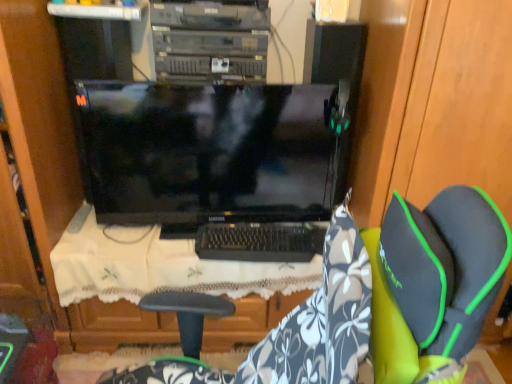
What are the coordinates of `wooden dresser at left` in the screenshot? It's located at (41, 133).

This screenshot has width=512, height=384. Describe the element at coordinates (210, 153) in the screenshot. I see `black glossy monitor at center` at that location.

Find the location of a particular element. black plastic keyboard at center is located at coordinates (258, 242).

This screenshot has height=384, width=512. Identify the location of wooden dresser at left. tap(41, 133).

There is a black plastic keyboard at center. At what (x,y) coordinates should I click in order to perform the action: click on chair above it (from a real-world perspective). Please return your answer as a coordinate pair (x, y). Looking at the image, I should click on (378, 302).

From the image's perspective, is floral fabric chair at center located beneath black plastic keyboard at center?

Yes, from the image's perspective, floral fabric chair at center is beneath black plastic keyboard at center.

Can you confirm if floral fabric chair at center is taller than black plastic keyboard at center?

Indeed, floral fabric chair at center has a greater height compared to black plastic keyboard at center.

Is floral fabric chair at center spatially inside black plastic keyboard at center, or outside of it?

floral fabric chair at center cannot be found inside black plastic keyboard at center.

Is wooden dresser at left smaller than black glossy monitor at center?

Incorrect, wooden dresser at left is not smaller in size than black glossy monitor at center.

Is wooden dresser at left to the left or to the right of black glossy monitor at center in the image?

wooden dresser at left is to the left of black glossy monitor at center.

From the picture: From a real-world perspective, is wooden dresser at left physically below black glossy monitor at center?

Yes.

Looking at this image, how different are the orientations of wooden dresser at left and black glossy monitor at center in degrees?

1.23 degrees separate the facing orientations of wooden dresser at left and black glossy monitor at center.

Relative to wooden dresser at left, is white lace cloth at center in front or behind?

white lace cloth at center is positioned farther from the viewer than wooden dresser at left.

Is white lace cloth at center far from wooden dresser at left?

No.

Could you tell me if white lace cloth at center is facing wooden dresser at left?

No.

Based on their sizes in the image, would you say white lace cloth at center is bigger or smaller than wooden dresser at left?

Considering their sizes, white lace cloth at center takes up less space than wooden dresser at left.

Find the location of a particular element. The width and height of the screenshot is (512, 384). chair that is below the white lace cloth at center (from the image's perspective) is located at coordinates (378, 302).

Considering the positions of point (60, 261) and point (385, 225), is point (60, 261) closer or farther from the camera than point (385, 225)?

Point (60, 261) is farther from the camera than point (385, 225).

From a real-world perspective, is white lace cloth at center below floral fabric chair at center?

Yes.

Is white lace cloth at center in front of or behind floral fabric chair at center in the image?

white lace cloth at center is positioned farther from the viewer than floral fabric chair at center.

Does wooden dresser at left have a lesser width compared to floral fabric chair at center?

Incorrect, the width of wooden dresser at left is not less than that of floral fabric chair at center.

Locate an element on the screen. The height and width of the screenshot is (384, 512). chair located in front of the wooden dresser at left is located at coordinates (378, 302).

Considering the sizes of objects wooden dresser at left and floral fabric chair at center in the image provided, who is shorter, wooden dresser at left or floral fabric chair at center?

floral fabric chair at center.

Between wooden dresser at left and floral fabric chair at center, which one appears on the right side from the viewer's perspective?

floral fabric chair at center.

From a real-world perspective, which is physically above, black plastic keyboard at center or wooden dresser at left?

From a 3D spatial view, wooden dresser at left is above.

Between black plastic keyboard at center and wooden dresser at left, which one has less height?

With less height is black plastic keyboard at center.

Can you confirm if black plastic keyboard at center is wider than wooden dresser at left?

No.

How many degrees apart are the facing directions of black glossy monitor at center and black plastic keyboard at center?

1.23 degrees.

Is black glossy monitor at center looking in the opposite direction of black plastic keyboard at center?

No.

From a real-world perspective, between black glossy monitor at center and black plastic keyboard at center, who is vertically lower?

From a 3D spatial view, black plastic keyboard at center is below.

The image size is (512, 384). I want to click on chair located in front of the black plastic keyboard at center, so click(x=378, y=302).

Find the location of `dresser located underneath the black glossy monitor at center (from a real-world perspective)`. dresser located underneath the black glossy monitor at center (from a real-world perspective) is located at coordinates (41, 133).

When comparing their distances from black glossy monitor at center, does black plastic keyboard at center or wooden dresser at left seem further?

Based on the image, wooden dresser at left appears to be further to black glossy monitor at center.

Considering their positions, is white lace cloth at center positioned closer to wooden dresser at left than black glossy monitor at center?

white lace cloth at center is closer to wooden dresser at left.

Based on their spatial positions, is wooden dresser at left or black plastic keyboard at center closer to floral fabric chair at center?

black plastic keyboard at center.

Considering their positions, is wooden dresser at left positioned closer to white lace cloth at center than black plastic keyboard at center?

black plastic keyboard at center.

Estimate the real-world distances between objects in this image. Which object is further from black glossy monitor at center, wooden dresser at left or floral fabric chair at center?

floral fabric chair at center lies further to black glossy monitor at center than the other object.

Which object lies further to the anchor point black glossy monitor at center, white lace cloth at center or wooden dresser at left?

The object further to black glossy monitor at center is wooden dresser at left.

Based on their spatial positions, is wooden dresser at left or black glossy monitor at center closer to floral fabric chair at center?

black glossy monitor at center.

In the scene shown: Looking at the image, which one is located closer to black plastic keyboard at center, black glossy monitor at center or floral fabric chair at center?

black glossy monitor at center.

Identify the location of furniture between wooden dresser at left and floral fabric chair at center from left to right. Image resolution: width=512 pixels, height=384 pixels. (170, 273).

What are the coordinates of `furniture located between wooden dresser at left and black glossy monitor at center in the left-right direction` in the screenshot? It's located at (170, 273).

In order to click on computer keyboard between wooden dresser at left and floral fabric chair at center in the horizontal direction in this screenshot , I will do `click(258, 242)`.

This screenshot has width=512, height=384. I want to click on furniture between wooden dresser at left and black plastic keyboard at center in the horizontal direction, so click(170, 273).